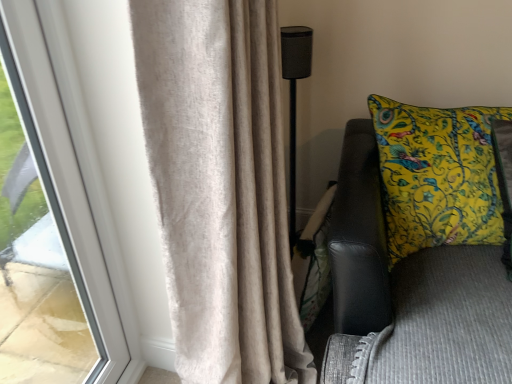
From the picture: What is the approximate height of black mesh speaker at center?

It is 34.03 inches.

Identify the location of yellow printed cushion at right. The height and width of the screenshot is (384, 512). (420, 250).

Considering the positions of objects yellow printed cushion at right and black mesh speaker at center in the image provided, who is more to the right, yellow printed cushion at right or black mesh speaker at center?

yellow printed cushion at right is more to the right.

This screenshot has width=512, height=384. What are the coordinates of `furniture below the black mesh speaker at center (from the image's perspective)` in the screenshot? It's located at (420, 250).

Does yellow printed cushion at right contain black mesh speaker at center?

No, black mesh speaker at center is located outside of yellow printed cushion at right.

Which object is thinner, yellow printed cushion at right or black mesh speaker at center?

With smaller width is black mesh speaker at center.

From a real-world perspective, between black mesh speaker at center and beige textured curtain at left, who is vertically higher?

beige textured curtain at left, from a real-world perspective.

Is beige textured curtain at left at the back of black mesh speaker at center?

No, beige textured curtain at left is not at the back of black mesh speaker at center.

Can you tell me how much black mesh speaker at center and beige textured curtain at left differ in facing direction?

The facing directions of black mesh speaker at center and beige textured curtain at left are 87.3 degrees apart.

From the image's perspective, which is below, black mesh speaker at center or beige textured curtain at left?

beige textured curtain at left appears lower in the image.

Between beige textured curtain at left and black mesh speaker at center, which one has smaller size?

Smaller between the two is black mesh speaker at center.

Is beige textured curtain at left thinner than black mesh speaker at center?

No.

How much distance is there between beige textured curtain at left and black mesh speaker at center?

beige textured curtain at left is 27.99 inches away from black mesh speaker at center.

Relative to yellow printed cushion at right, is beige textured curtain at left in front or behind?

beige textured curtain at left is positioned closer to the viewer than yellow printed cushion at right.

Is beige textured curtain at left inside the boundaries of yellow printed cushion at right, or outside?

beige textured curtain at left is not enclosed by yellow printed cushion at right.

Which is in front, point (239, 274) or point (410, 308)?

The point (239, 274) is closer.

From the picture: Is beige textured curtain at left positioned with its back to yellow printed cushion at right?

No, beige textured curtain at left is not facing the opposite direction of yellow printed cushion at right.

Is point (307, 43) positioned behind point (430, 218)?

Yes, point (307, 43) is behind point (430, 218).

From the picture: Considering the sizes of objects black mesh speaker at center and yellow printed cushion at right in the image provided, who is thinner, black mesh speaker at center or yellow printed cushion at right?

black mesh speaker at center is thinner.

Looking at this image, considering the sizes of objects black mesh speaker at center and yellow printed cushion at right in the image provided, who is smaller, black mesh speaker at center or yellow printed cushion at right?

black mesh speaker at center is smaller.

From a real-world perspective, who is located lower, black mesh speaker at center or yellow printed cushion at right?

black mesh speaker at center, from a real-world perspective.

Which is in front, point (327, 352) or point (267, 122)?

The point (267, 122) is closer.

Can you confirm if yellow printed cushion at right is smaller than beige textured curtain at left?

Correct, yellow printed cushion at right occupies less space than beige textured curtain at left.

Which of these two, yellow printed cushion at right or beige textured curtain at left, stands taller?

beige textured curtain at left is taller.

This screenshot has width=512, height=384. In order to click on furniture above the black mesh speaker at center (from a real-world perspective) in this screenshot , I will do `click(420, 250)`.

Find the location of a particular element. The image size is (512, 384). lamp behind the beige textured curtain at left is located at coordinates (294, 100).

When comparing their distances from yellow printed cushion at right, does black mesh speaker at center or beige textured curtain at left seem further?

black mesh speaker at center is positioned further to the anchor yellow printed cushion at right.

Based on their spatial positions, is beige textured curtain at left or yellow printed cushion at right closer to black mesh speaker at center?

yellow printed cushion at right.

When comparing their distances from yellow printed cushion at right, does beige textured curtain at left or black mesh speaker at center seem further?

Based on the image, black mesh speaker at center appears to be further to yellow printed cushion at right.

From the image, which object appears to be nearer to beige textured curtain at left, yellow printed cushion at right or black mesh speaker at center?

Among the two, yellow printed cushion at right is located nearer to beige textured curtain at left.

Looking at this image, when comparing their distances from black mesh speaker at center, does yellow printed cushion at right or beige textured curtain at left seem closer?

The object closer to black mesh speaker at center is yellow printed cushion at right.

Which object lies nearer to the anchor point beige textured curtain at left, black mesh speaker at center or yellow printed cushion at right?

yellow printed cushion at right.

At what (x,y) coordinates should I click in order to perform the action: click on furniture positioned between beige textured curtain at left and black mesh speaker at center from near to far. Please return your answer as a coordinate pair (x, y). The width and height of the screenshot is (512, 384). Looking at the image, I should click on (420, 250).